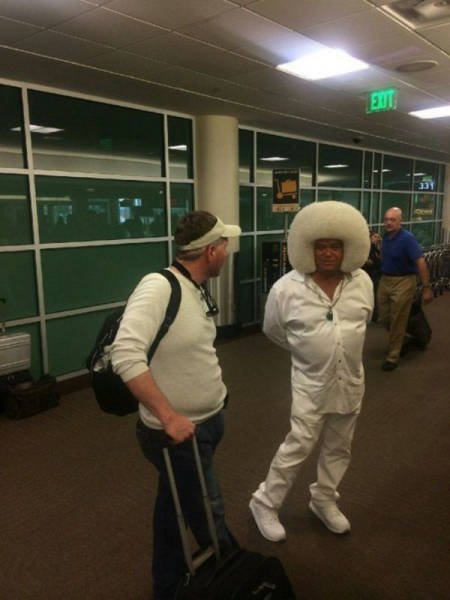
Locate an element on the screen. exit sign is located at coordinates (379, 103).